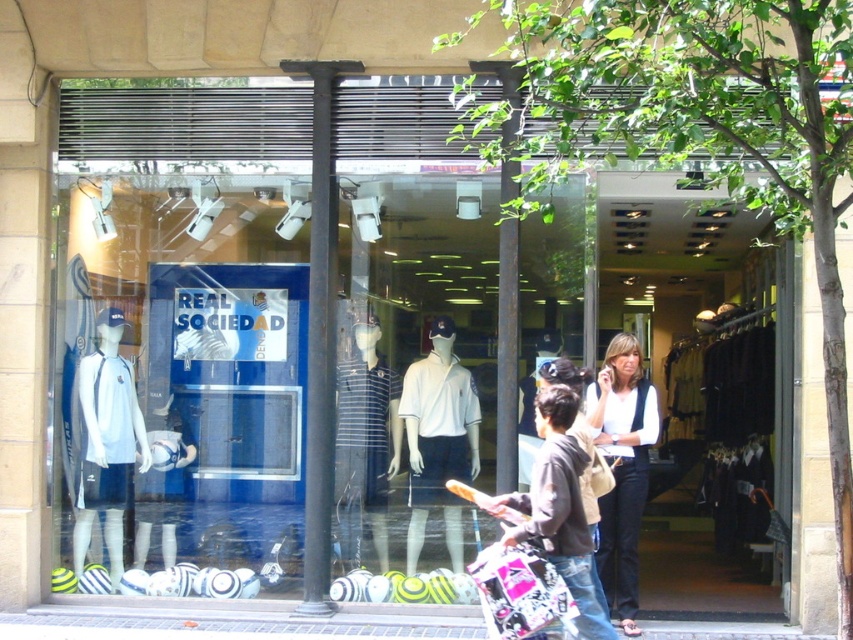
Can you confirm if white matte polo shirt at center is bigger than dark brown hoodie at center?

No, white matte polo shirt at center is not bigger than dark brown hoodie at center.

Between white matte polo shirt at center and dark brown hoodie at center, which one appears on the right side from the viewer's perspective?

From the viewer's perspective, dark brown hoodie at center appears more on the right side.

Locate an element on the screen. This screenshot has height=640, width=853. white matte polo shirt at center is located at coordinates (438, 440).

At what (x,y) coordinates should I click in order to perform the action: click on white matte polo shirt at center. Please return your answer as a coordinate pair (x, y). The width and height of the screenshot is (853, 640). Looking at the image, I should click on (438, 440).

Which is below, white jersey at center or striped fabric polo shirt at center?

white jersey at center is lower down.

Is white jersey at center thinner than striped fabric polo shirt at center?

In fact, white jersey at center might be wider than striped fabric polo shirt at center.

Who is more distant from viewer, (625, 528) or (381, 556)?

The point (381, 556) is more distant.

Identify the location of white jersey at center. (624, 474).

Who is taller, white matte polo shirt at center or striped fabric polo shirt at center?

white matte polo shirt at center is taller.

Does white matte polo shirt at center have a greater width compared to striped fabric polo shirt at center?

Indeed, white matte polo shirt at center has a greater width compared to striped fabric polo shirt at center.

The width and height of the screenshot is (853, 640). What do you see at coordinates (438, 440) in the screenshot?
I see `white matte polo shirt at center` at bounding box center [438, 440].

At what (x,y) coordinates should I click in order to perform the action: click on white matte polo shirt at center. Please return your answer as a coordinate pair (x, y). Looking at the image, I should click on (438, 440).